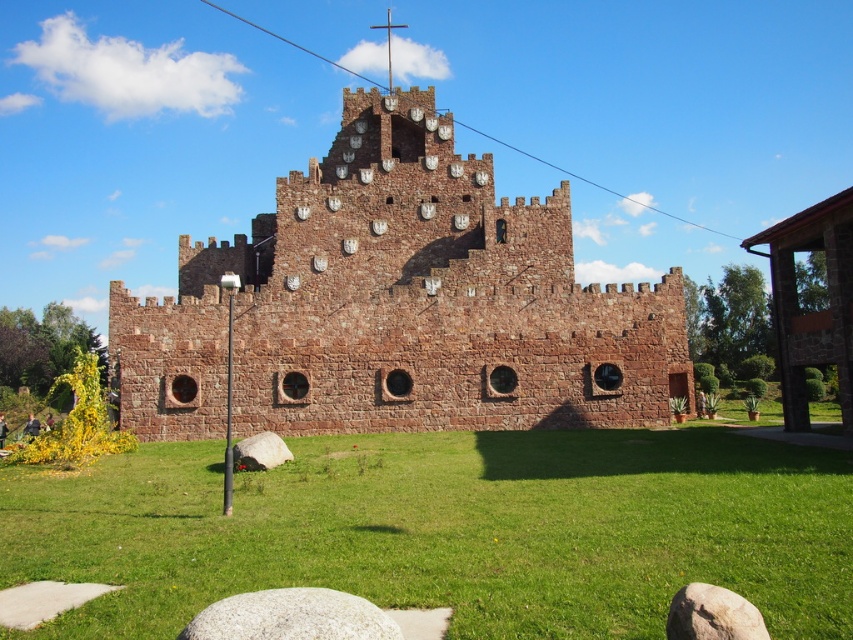
You are standing in front of the medieval building and notice the green grass at center and the brown rough stone at lower right. Which object is positioned to the left of the other?

The green grass at center is to the left of the brown rough stone at lower right.

You are standing on the lawn in front of the medieval building and want to walk to the cross on the roof. There are two points marked on the path you need to pass through. Which point should you reach first, point (845, 584) or point (358, 604)?

You should reach point (358, 604) first because point (845, 584) is behind it according to the description.